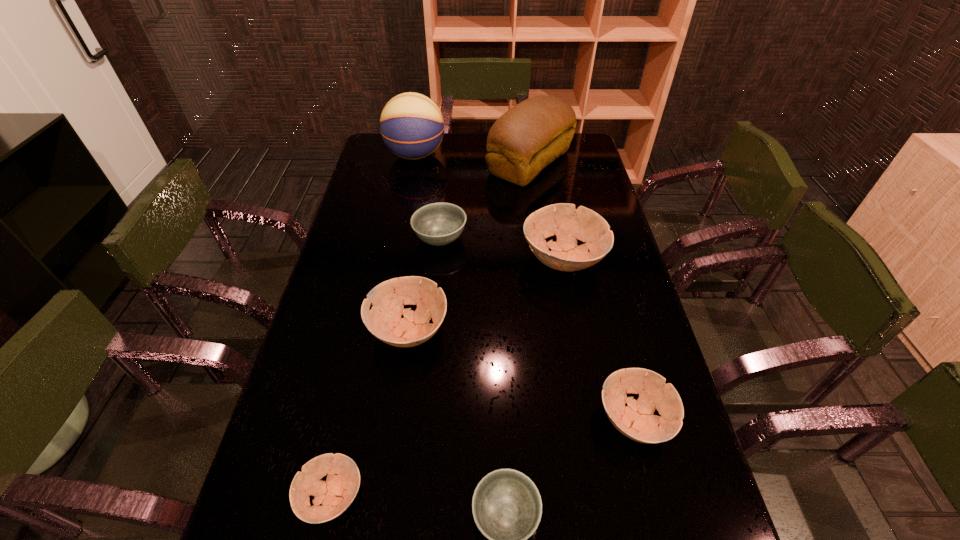
You are a GUI agent. You are given a task and a screenshot of the screen. Output one action in this format:
    pyautogui.click(x=<x>, y=<y>)
    Task: Click on the unoccupied position between the bread and the bigger gray bowl
    
    Given the screenshot: What is the action you would take?
    pyautogui.click(x=485, y=200)

Find the location of a particular element. free space between the farthest brown bowl and the nearest brown bowl is located at coordinates (447, 377).

The height and width of the screenshot is (540, 960). In order to click on free spot between the farther gray bowl and the basketball in this screenshot , I will do `click(428, 197)`.

Identify the location of empty space between the third nearest brown bowl and the third farthest brown bowl. The height and width of the screenshot is (540, 960). (521, 374).

Locate an element on the screen. The height and width of the screenshot is (540, 960). unoccupied area between the fourth farthest bowl and the farthest brown bowl is located at coordinates (598, 339).

Locate which object ranks second in proximity to the third biggest brown bowl. Please provide its 2D coordinates. Your answer should be formatted as a tuple, i.e. [(x, y)], where the tuple contains the x and y coordinates of a point satisfying the conditions above.

[(568, 224)]

Identify which object is the seventh nearest to the left gray bowl. Please provide its 2D coordinates. Your answer should be formatted as a tuple, i.e. [(x, y)], where the tuple contains the x and y coordinates of a point satisfying the conditions above.

[(506, 505)]

The height and width of the screenshot is (540, 960). I want to click on bowl that is the fourth nearest to the bread, so click(636, 421).

Locate an element on the screen. The height and width of the screenshot is (540, 960). bowl that is the fifth closest to the right gray bowl is located at coordinates (438, 224).

Where is `brown bowl that can be found as the third closest to the tallest bowl`? brown bowl that can be found as the third closest to the tallest bowl is located at coordinates (336, 494).